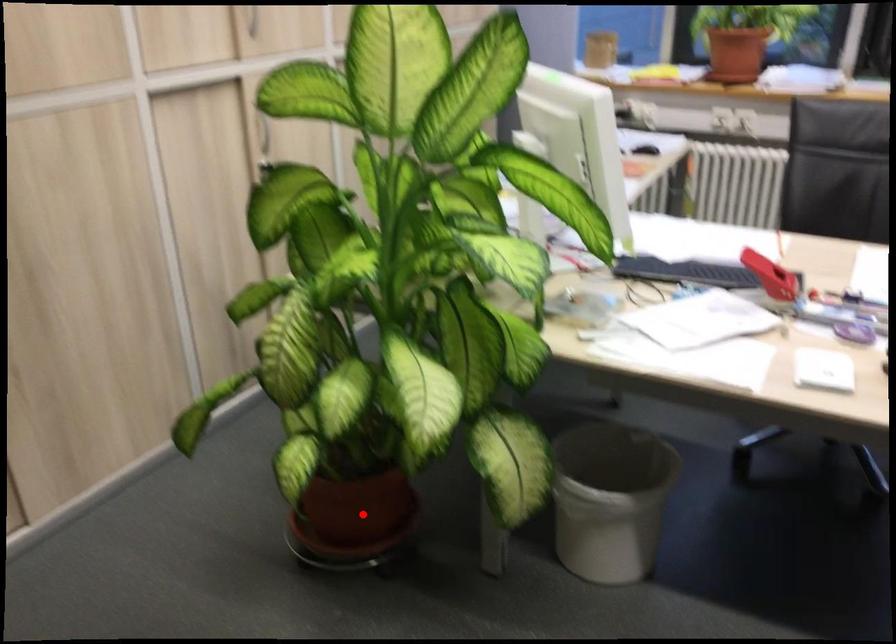
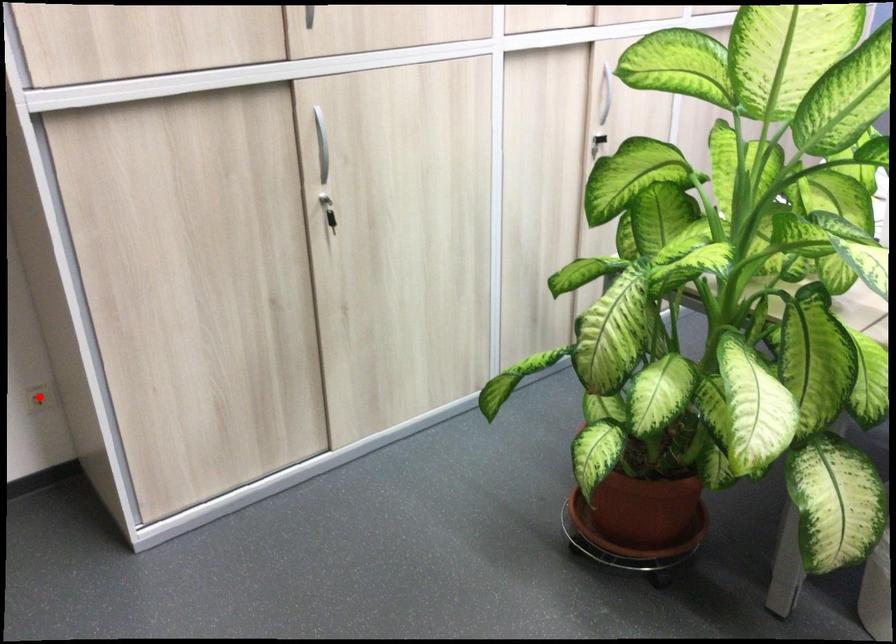
I am providing you with two images of the same scene from different viewpoints. A red point is marked on the first image and another point is marked on the second image. Do the highlighted points in image1 and image2 indicate the same real-world spot?

No